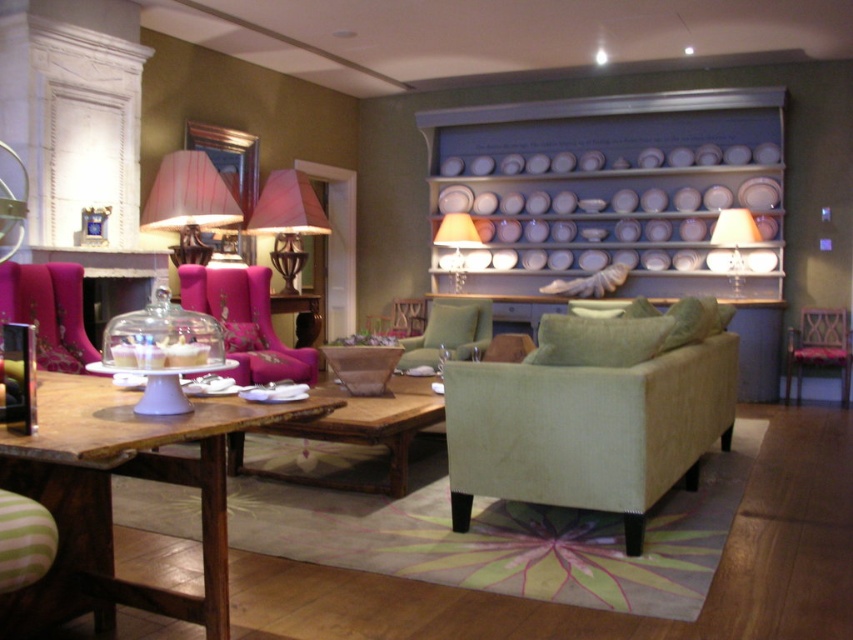
Question: Which object is closer to the camera taking this photo?

Choices:
 (A) matte white lampshade at upper right
 (B) velvet pink armchair at left
 (C) matte pink fabric lampshade at center
 (D) matte white lampshade at upper center

Answer: (B)

Question: Does light beige fabric couch at center have a greater width compared to matte white lampshade at upper right?

Choices:
 (A) yes
 (B) no

Answer: (A)

Question: Which of the following is the farthest from the observer?

Choices:
 (A) light beige fabric couch at center
 (B) wooden table at lower left

Answer: (A)

Question: In this image, where is wooden table at lower left located relative to rustic wood coffee table at center?

Choices:
 (A) below
 (B) above

Answer: (B)

Question: Does light beige fabric couch at center appear on the left side of matte pink fabric lampshade at center?

Choices:
 (A) no
 (B) yes

Answer: (A)

Question: Considering the real-world distances, which object is farthest from the light beige fabric couch at center?

Choices:
 (A) matte pink fabric lampshade at center
 (B) velvet pink armchair at center
 (C) pink fabric lampshade at upper left

Answer: (A)